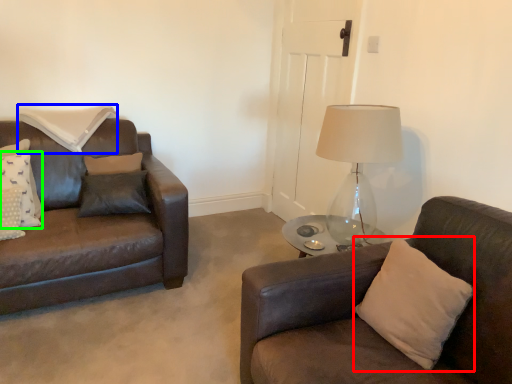
Question: Based on their relative distances, which object is farther from pillow (highlighted by a red box)? Choose from pillow (highlighted by a blue box) and pillow (highlighted by a green box).

Choices:
 (A) pillow
 (B) pillow

Answer: (A)